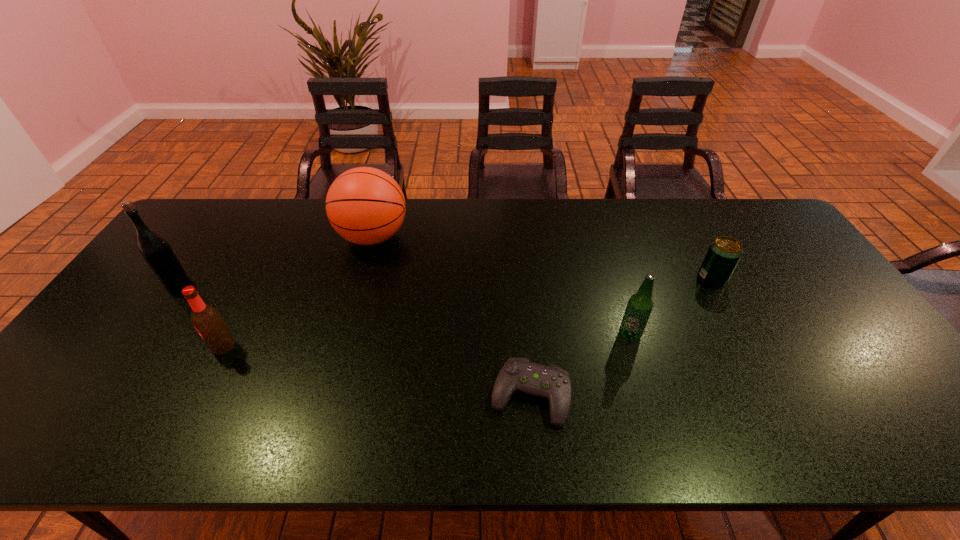
The image size is (960, 540). What are the coordinates of `vacant space located on the back of the tallest beer bottle` in the screenshot? It's located at (197, 252).

Identify the location of free spot located on the right of the farthest object. (482, 237).

I want to click on vacant space located 0.120m on the label of the second object from right to left, so click(x=645, y=384).

Identify the location of free location located on the right of the second beer bottle from right to left. This screenshot has height=540, width=960. (375, 346).

You are a GUI agent. You are given a task and a screenshot of the screen. Output one action in this format:
    pyautogui.click(x=<x>, y=<y>)
    Task: Click on the vacant space located on the back of the rightmost object
    The height and width of the screenshot is (540, 960).
    Given the screenshot: What is the action you would take?
    pyautogui.click(x=693, y=242)

At what (x,y) coordinates should I click in order to perform the action: click on free region located 0.060m on the back of the shortest object. Please return your answer as a coordinate pair (x, y). Looking at the image, I should click on (526, 346).

Find the location of a particular element. The image size is (960, 540). object that is at the far edge is located at coordinates (366, 206).

Find the location of a particular element. This screenshot has width=960, height=540. object at the near edge is located at coordinates (518, 374).

I want to click on object that is positioned at the left edge, so click(157, 252).

The height and width of the screenshot is (540, 960). Find the location of `vacant space at the far edge of the desktop`. vacant space at the far edge of the desktop is located at coordinates tap(577, 238).